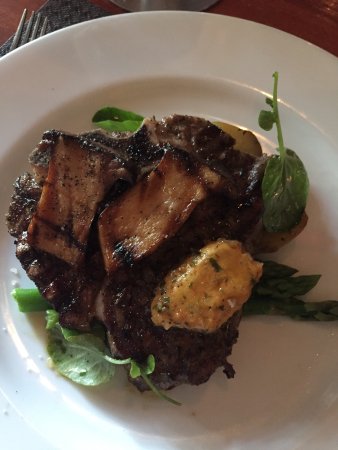
Find what you put under a plate in the image. Your answer should be formatted as a list of tuples, i.e. [(x1, y1), (x2, y2), ...], where each tuple contains the x and y coordinates of a point satisfying the conditions above.

[(70, 11)]